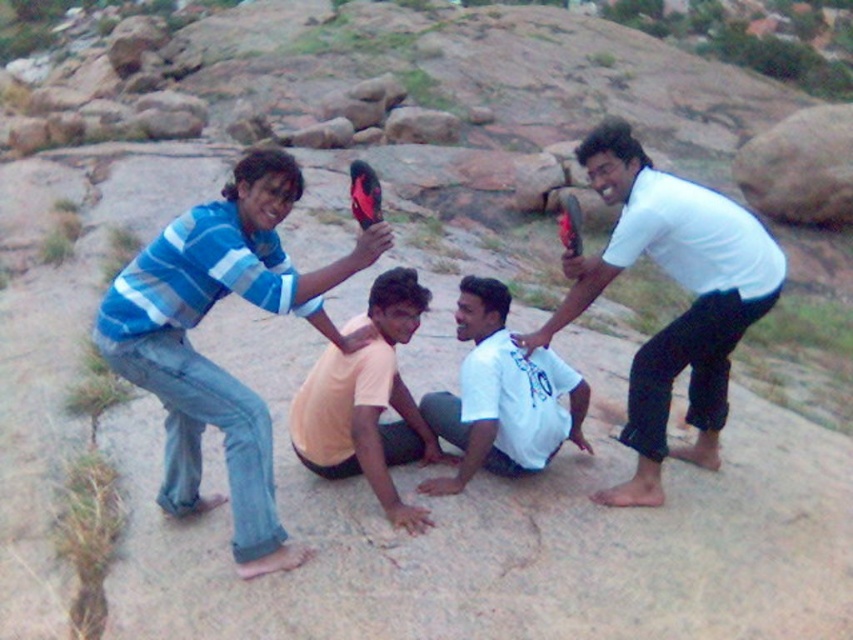
Does white matte shirt at upper right have a lesser width compared to white cotton shirt at center?

No, white matte shirt at upper right is not thinner than white cotton shirt at center.

Between point (666, 387) and point (467, 300), which one is positioned behind?

Positioned behind is point (467, 300).

From the picture: Measure the distance between point (721, 401) and camera.

Point (721, 401) and camera are 5.05 meters apart.

This screenshot has width=853, height=640. I want to click on white matte shirt at upper right, so click(682, 285).

Is blue striped shirt at upper left shorter than orange cotton shirt at center?

In fact, blue striped shirt at upper left may be taller than orange cotton shirt at center.

Does blue striped shirt at upper left have a greater width compared to orange cotton shirt at center?

Yes.

At what (x,y) coordinates should I click in order to perform the action: click on blue striped shirt at upper left. Please return your answer as a coordinate pair (x, y). Looking at the image, I should click on (207, 358).

Is orange cotton shirt at center positioned at the back of white cotton shirt at center?

That is False.

How distant is orange cotton shirt at center from white cotton shirt at center?

orange cotton shirt at center and white cotton shirt at center are 16.01 inches apart from each other.

Measure the distance between point (309, 396) and camera.

Point (309, 396) is 15.24 feet away from camera.

Where is `orange cotton shirt at center`? orange cotton shirt at center is located at coordinates (367, 403).